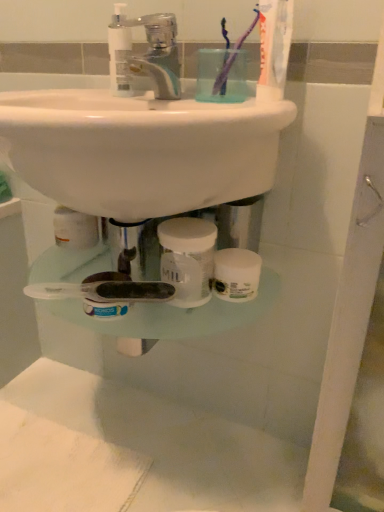
Question: Can you confirm if clear plastic faucet at upper center is shorter than transparent plastic mouthwash at upper center, which is the 1th mouthwash in left-to-right order?

Choices:
 (A) no
 (B) yes

Answer: (B)

Question: Does clear plastic faucet at upper center have a greater width compared to transparent plastic mouthwash at upper center, which is the 1th mouthwash in left-to-right order?

Choices:
 (A) yes
 (B) no

Answer: (A)

Question: From the image's perspective, does clear plastic faucet at upper center appear lower than transparent plastic mouthwash at upper center, which is the 1th mouthwash in left-to-right order?

Choices:
 (A) yes
 (B) no

Answer: (A)

Question: From the image's perspective, is clear plastic faucet at upper center on top of transparent plastic mouthwash at upper center, the 2th mouthwash from the right?

Choices:
 (A) yes
 (B) no

Answer: (B)

Question: Can you confirm if clear plastic faucet at upper center is taller than transparent plastic mouthwash at upper center, the 1th mouthwash viewed from the top?

Choices:
 (A) yes
 (B) no

Answer: (B)

Question: Is purple translucent toothbrush at upper center, the 1th toothbrush when ordered from right to left, situated inside clear plastic faucet at upper center or outside?

Choices:
 (A) inside
 (B) outside

Answer: (B)

Question: From the image's perspective, is purple translucent toothbrush at upper center, the 1th toothbrush when ordered from right to left, positioned above or below clear plastic faucet at upper center?

Choices:
 (A) below
 (B) above

Answer: (B)

Question: From their relative heights in the image, would you say purple translucent toothbrush at upper center, the 2th toothbrush when ordered from left to right, is taller or shorter than clear plastic faucet at upper center?

Choices:
 (A) tall
 (B) short

Answer: (A)

Question: In the image, is purple translucent toothbrush at upper center, the 1th toothbrush when ordered from right to left, positioned in front of or behind clear plastic faucet at upper center?

Choices:
 (A) front
 (B) behind

Answer: (B)

Question: Relative to white opaque jar at center, positioned as the second mouthwash in top-to-bottom order, is purple translucent toothbrush at upper center, the 2th toothbrush when ordered from left to right, in front or behind?

Choices:
 (A) behind
 (B) front

Answer: (A)

Question: Visually, is purple translucent toothbrush at upper center, the 2th toothbrush when ordered from left to right, positioned to the left or to the right of white opaque jar at center, the 1th mouthwash in the bottom-to-top sequence?

Choices:
 (A) left
 (B) right

Answer: (B)

Question: Considering the positions of purple translucent toothbrush at upper center, the 1th toothbrush when ordered from right to left, and white opaque jar at center, the 1th mouthwash in the bottom-to-top sequence, in the image, is purple translucent toothbrush at upper center, the 1th toothbrush when ordered from right to left, taller or shorter than white opaque jar at center, the 1th mouthwash in the bottom-to-top sequence,?

Choices:
 (A) short
 (B) tall

Answer: (B)

Question: Based on their sizes in the image, would you say purple translucent toothbrush at upper center, the 2th toothbrush when ordered from left to right, is bigger or smaller than white opaque jar at center, the 1th mouthwash in the bottom-to-top sequence?

Choices:
 (A) big
 (B) small

Answer: (B)

Question: Does point (122, 74) appear closer or farther from the camera than point (223, 67)?

Choices:
 (A) closer
 (B) farther

Answer: (B)

Question: In the image, is transparent plastic mouthwash at upper center, the 2th mouthwash from the right, on the left side or the right side of purple translucent toothbrush at upper center, the 1th toothbrush when ordered from right to left?

Choices:
 (A) right
 (B) left

Answer: (B)